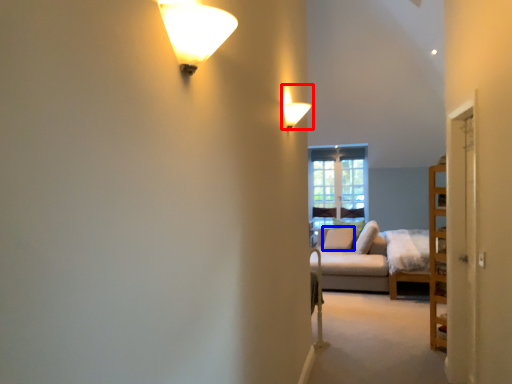
Question: Which object appears farthest to the camera in this image, lamp (highlighted by a red box) or pillow (highlighted by a blue box)?

Choices:
 (A) lamp
 (B) pillow

Answer: (B)